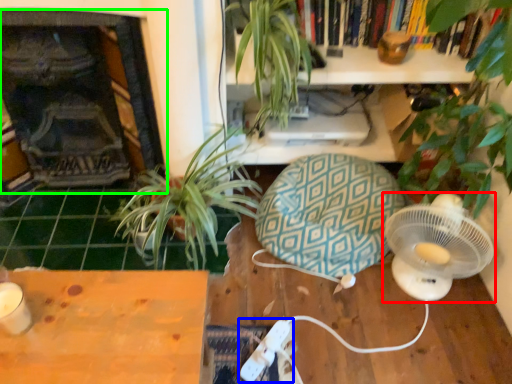
Question: Which object is the farthest from mechanical fan (highlighted by a red box)? Choose among these: Wii controller (highlighted by a blue box) or fireplace (highlighted by a green box).

Choices:
 (A) Wii controller
 (B) fireplace

Answer: (B)